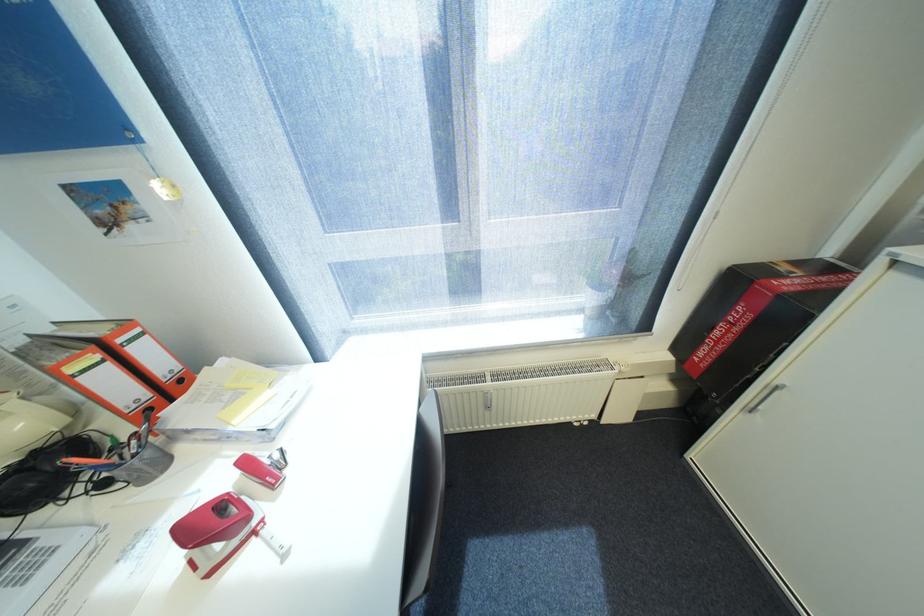
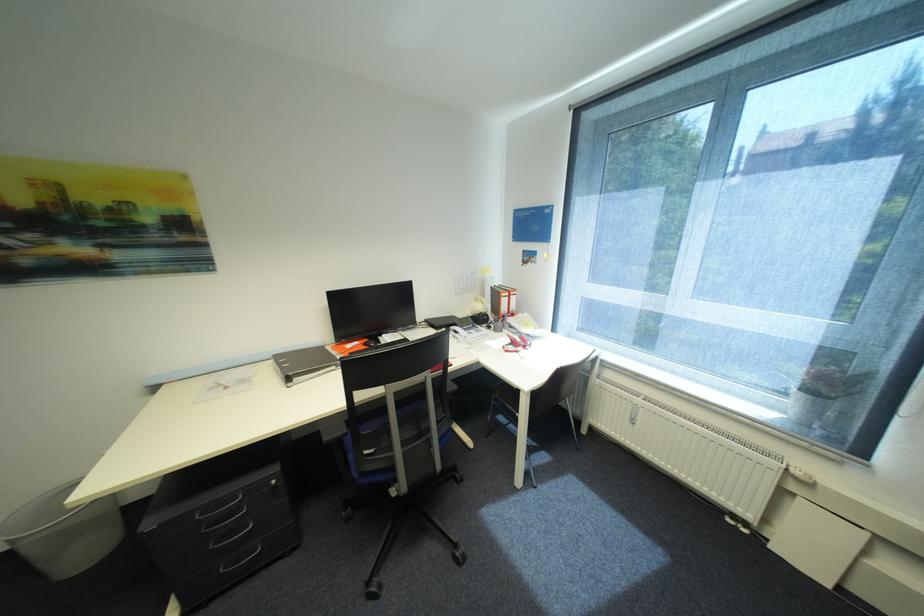
Find the pixel in the second image that matches pixel 139 227 in the first image.

(537, 265)